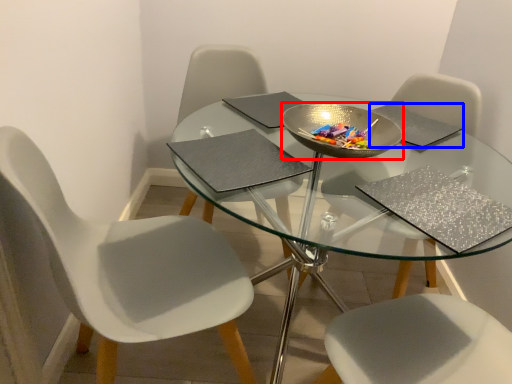
Question: Among these objects, which one is nearest to the camera, bowl (highlighted by a red box) or pad (highlighted by a blue box)?

Choices:
 (A) bowl
 (B) pad

Answer: (A)